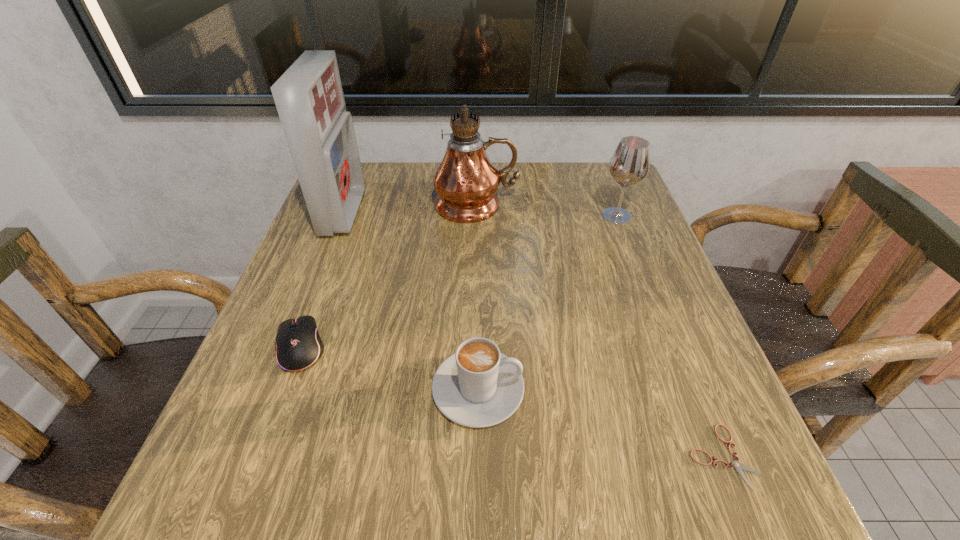
Image resolution: width=960 pixels, height=540 pixels. What are the coordinates of `vacant space in between the wineglass and the shortest object` in the screenshot? It's located at (669, 336).

Where is `unoccupied position between the fifth shortest object and the shears`? The image size is (960, 540). unoccupied position between the fifth shortest object and the shears is located at coordinates (533, 335).

Identify the location of vacant area that lies between the shortest object and the fifth shortest object. pos(533,335).

Identify the location of free spot between the second shortest object and the third tallest object. This screenshot has height=540, width=960. (459, 282).

You are a GUI agent. You are given a task and a screenshot of the screen. Output one action in this format:
    pyautogui.click(x=<x>, y=<y>)
    Task: Click on the unoccupied area between the computer mouse and the oil lamp
    The height and width of the screenshot is (540, 960).
    Given the screenshot: What is the action you would take?
    pyautogui.click(x=389, y=276)

Identify the location of free space between the cappuccino and the fifth tallest object. This screenshot has height=540, width=960. (389, 368).

I want to click on vacant space in between the first-aid kit and the computer mouse, so click(x=323, y=280).

Find the location of a particular element. The height and width of the screenshot is (540, 960). object that can be found as the third closest to the second shortest object is located at coordinates (466, 180).

Locate an element on the screen. The width and height of the screenshot is (960, 540). object that stands as the third closest to the fourth tallest object is located at coordinates (466, 180).

Identify the location of free point that satisfies the following two spatial constraints: 1. on the front-facing side of the wineglass; 2. on the left side of the second tallest object. The height and width of the screenshot is (540, 960). (343, 216).